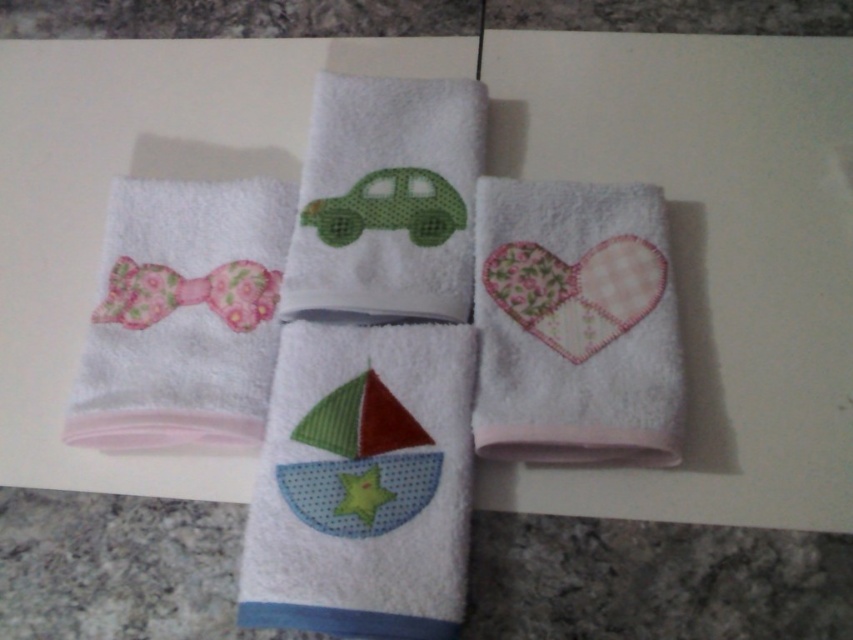
Who is more forward, (648, 376) or (247, 305)?

Point (648, 376) is more forward.

Find the location of a particular element. The height and width of the screenshot is (640, 853). patchwork heart at center is located at coordinates click(575, 324).

Which is more to the right, green textured car at center or floral fabric bow tie at left?

green textured car at center

Does green textured car at center appear over floral fabric bow tie at left?

Yes.

Where is `green textured car at center`? The image size is (853, 640). green textured car at center is located at coordinates (386, 200).

Can you confirm if white soft sailboat at center is taller than green textured car at center?

Indeed, white soft sailboat at center has a greater height compared to green textured car at center.

Between white soft sailboat at center and green textured car at center, which one appears on the right side from the viewer's perspective?

Positioned to the right is green textured car at center.

Measure the distance between white soft sailboat at center and camera.

1.17 meters

Identify the location of white soft sailboat at center. (363, 483).